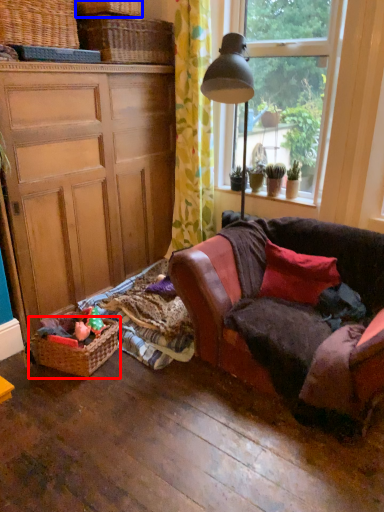
Question: Which object appears closest to the camera in this image, picnic basket (highlighted by a red box) or basket (highlighted by a blue box)?

Choices:
 (A) picnic basket
 (B) basket

Answer: (A)